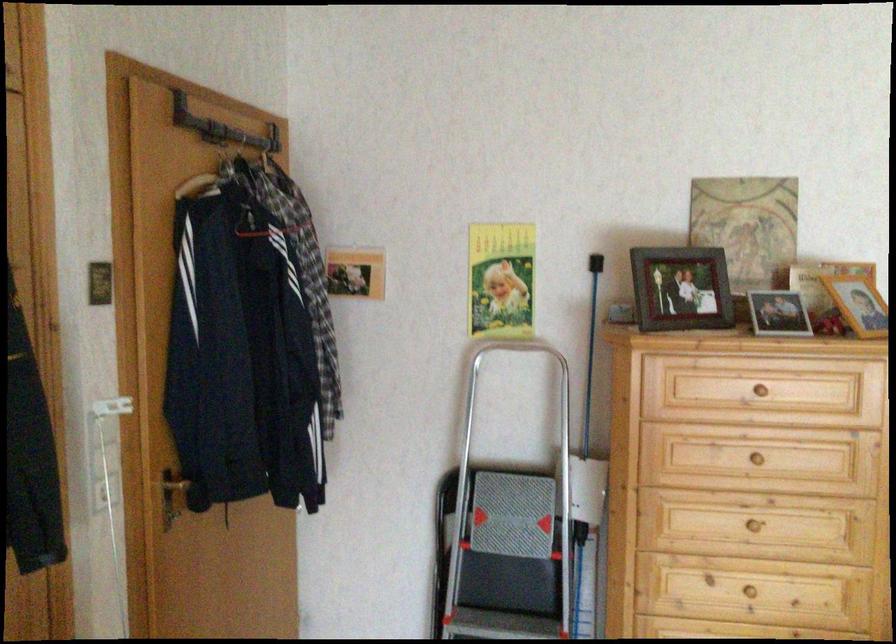
Where would you turn the gold door handle? Please return your answer as a coordinate pair (x, y).

(175, 480)